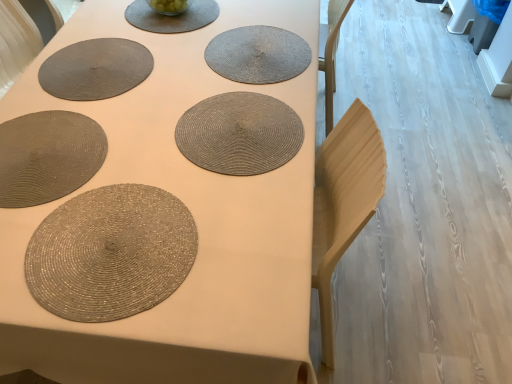
What are the coordinates of `free space to the back side of shiny metallic placemat at bottom left, which ranks as the third paper plate in top-to-bottom order` in the screenshot? It's located at (113, 147).